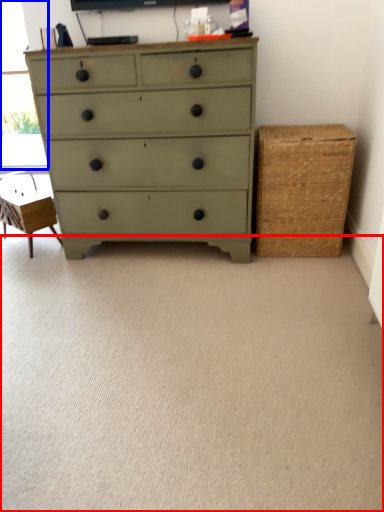
Question: Which object is closer to the camera taking this photo, plain (highlighted by a red box) or window screen (highlighted by a blue box)?

Choices:
 (A) plain
 (B) window screen

Answer: (A)